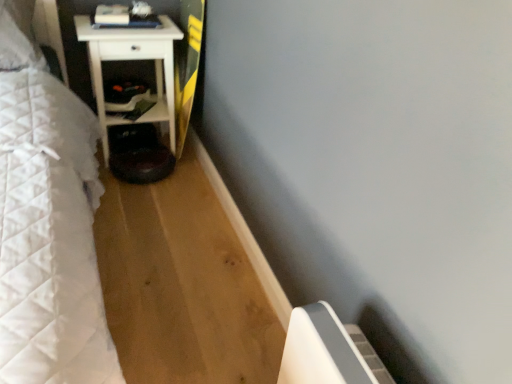
This screenshot has width=512, height=384. What are the coordinates of `vacant space situated above shiny black step stool at lower center (from a real-world perspective)` in the screenshot? It's located at (140, 155).